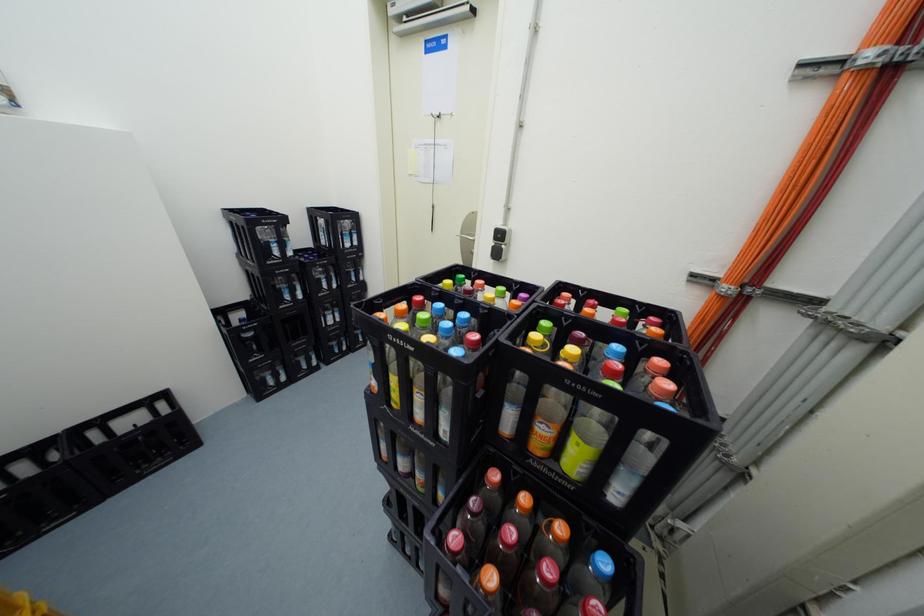
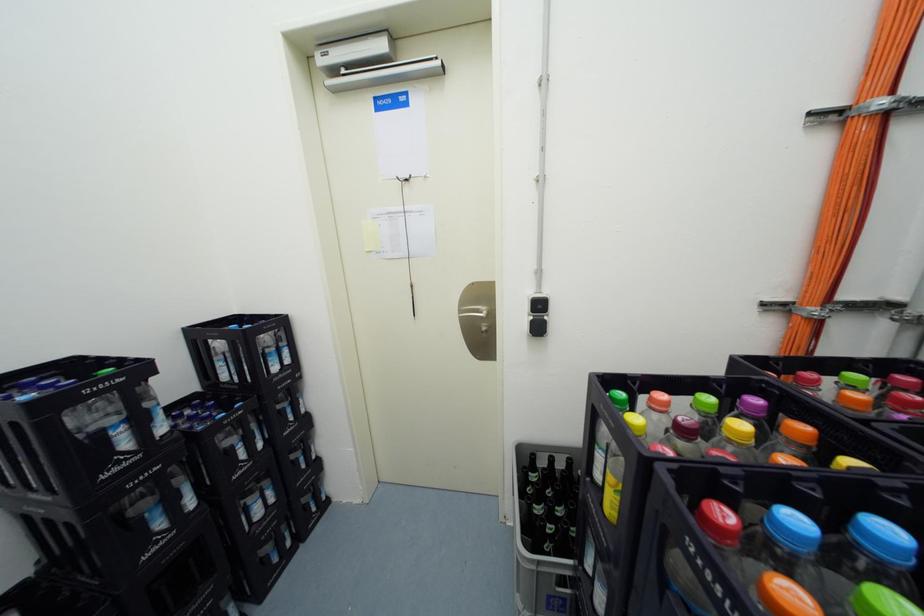
Question: How did the camera likely rotate?

Choices:
 (A) Left
 (B) Right
 (C) Up
 (D) Down

Answer: (B)